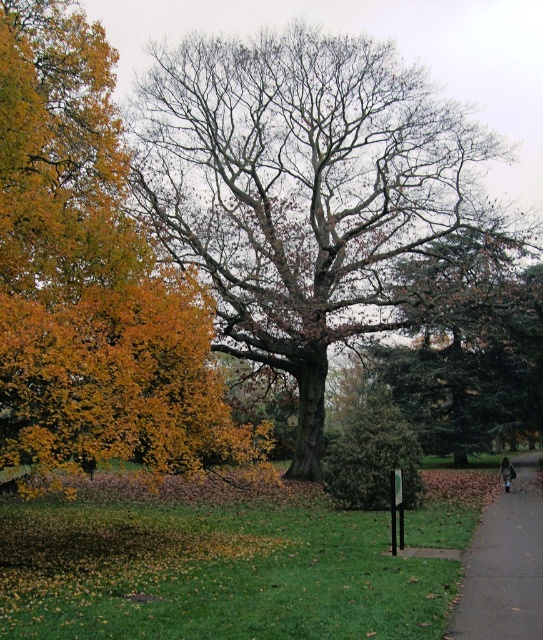
You are standing in the park and want to take a photo of the bare wood oak tree at center. If your camera can focus on objects up to 20 meters away, will you be able to capture a clear image of the tree?

The bare wood oak tree at center is 20.13 meters from the viewer. Since the camera can focus up to 20 meters, the distance is slightly beyond its range. Therefore, the camera may not be able to focus clearly on the tree.

You are standing in the park and want to take a photo of the bare wood oak tree at center. Which direction should you walk to get closer to it?

Since the bare wood oak tree at center is located at point (305, 193), you should walk towards the center of the park to get closer to it.

You are standing in the park and want to take a photo of the golden yellow leaves at left and the gray concrete pavement at lower right. Which object is taller?

The golden yellow leaves at left is taller than the gray concrete pavement at lower right.